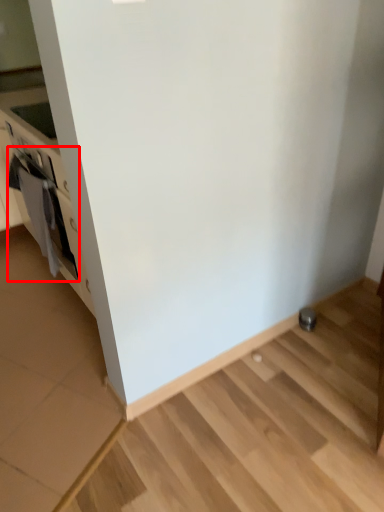
Question: From the image, what is the correct spatial relationship of oven (annotated by the red box) in relation to appliance?

Choices:
 (A) right
 (B) left

Answer: (B)